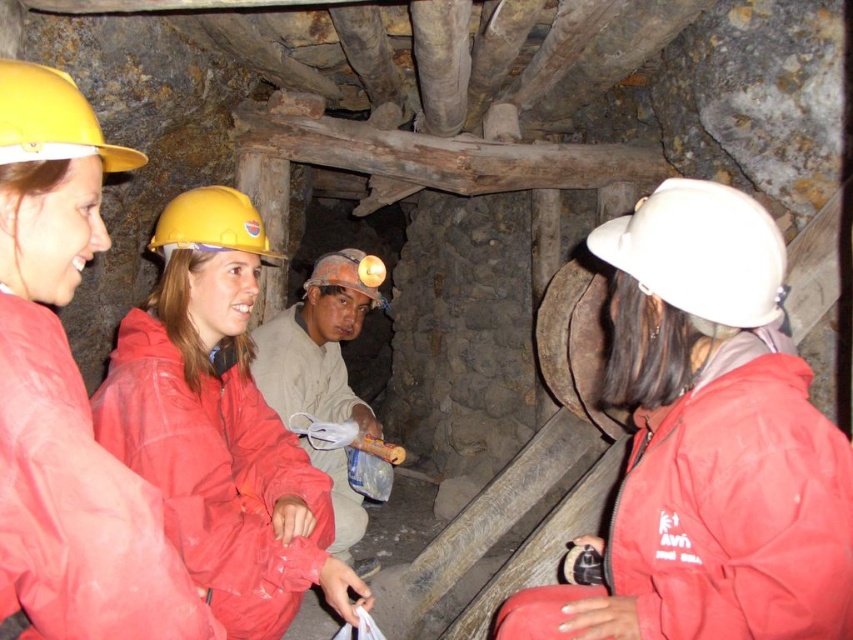
Question: Is matte white helmet at center below matte gray helmet at center?

Choices:
 (A) yes
 (B) no

Answer: (B)

Question: In this image, where is yellow matte helmet at upper left located relative to yellow matte helmet at center?

Choices:
 (A) above
 (B) below

Answer: (A)

Question: Based on their relative distances, which object is nearer to the matte red jacket at upper left?

Choices:
 (A) yellow matte helmet at upper left
 (B) yellow matte helmet at center
 (C) white matte helmet at right

Answer: (A)

Question: Which object appears closest to the camera in this image?

Choices:
 (A) matte white helmet at center
 (B) yellow matte helmet at upper left
 (C) matte red jacket at upper left
 (D) yellow matte helmet at center

Answer: (C)

Question: Which point appears closest to the camera in this image?

Choices:
 (A) (219, 250)
 (B) (372, 257)
 (C) (335, 301)

Answer: (A)

Question: Can you confirm if matte red jacket at upper left is wider than yellow matte helmet at upper left?

Choices:
 (A) no
 (B) yes

Answer: (B)